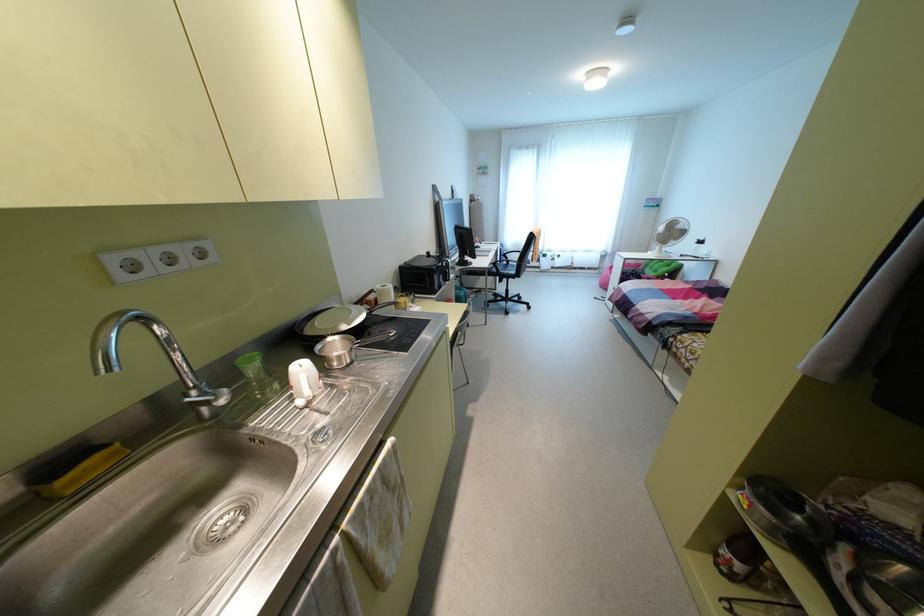
Find where to resting arm the chair armrest. Please return your answer as a coordinate pair (x, y).

(506, 262)